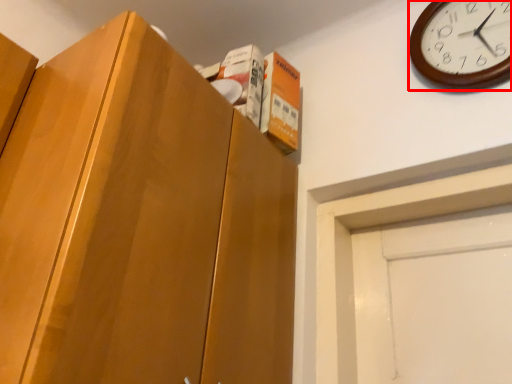
Question: Observing the image, what is the correct spatial positioning of wall clock (annotated by the red box) in reference to cabinetry?

Choices:
 (A) left
 (B) right

Answer: (B)